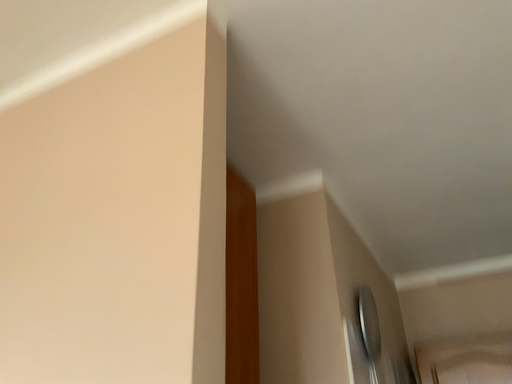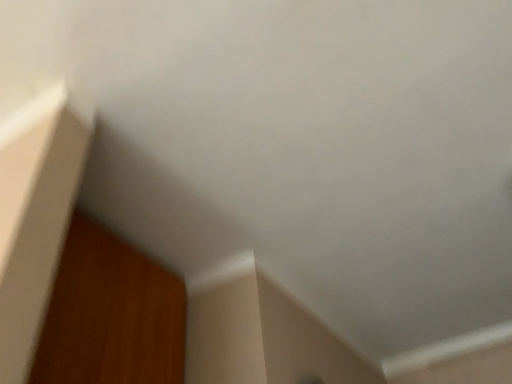
Question: How did the camera likely rotate when shooting the video?

Choices:
 (A) rotated downward
 (B) rotated upward

Answer: (B)